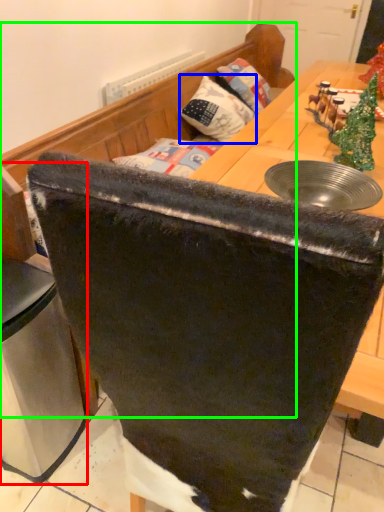
Question: Considering the real-world distances, which object is closest to leftover (highlighted by a red box)? pillow (highlighted by a blue box) or furniture (highlighted by a green box).

Choices:
 (A) pillow
 (B) furniture

Answer: (B)